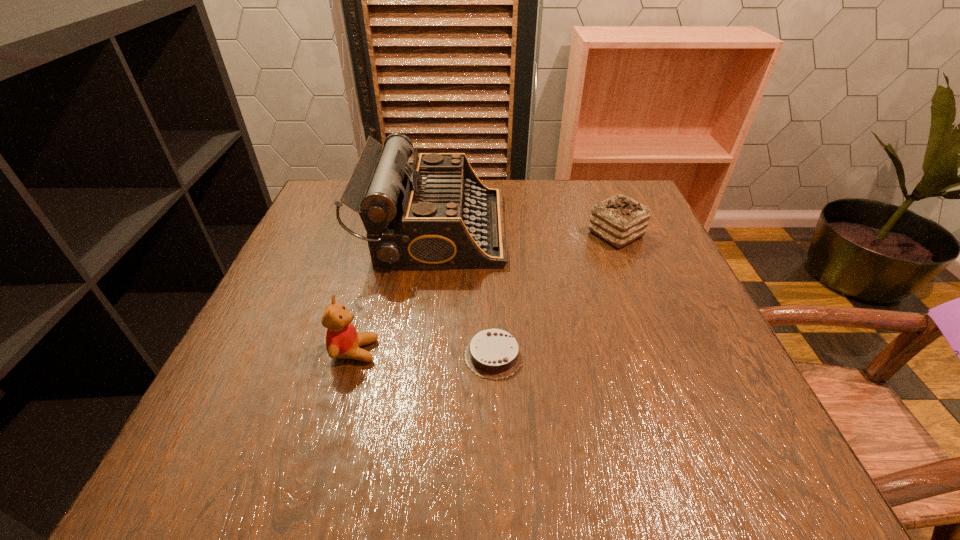
I want to click on free space between the third shortest object and the tallest object, so click(x=395, y=289).

Image resolution: width=960 pixels, height=540 pixels. What are the coordinates of `free space between the shorter chocolate cake and the third shortest object` in the screenshot? It's located at (424, 353).

At what (x,y) coordinates should I click in order to perform the action: click on the closest object relative to the taller chocolate cake. Please return your answer as a coordinate pair (x, y). The height and width of the screenshot is (540, 960). Looking at the image, I should click on (434, 214).

Locate an element on the screen. The width and height of the screenshot is (960, 540). object identified as the third closest to the third shortest object is located at coordinates (619, 220).

This screenshot has height=540, width=960. In order to click on free space that satisfies the following two spatial constraints: 1. on the back side of the farther chocolate cake; 2. on the keyboard of the typewriter in this screenshot , I will do `click(613, 228)`.

Identify the location of vacant space that satisfies the following two spatial constraints: 1. on the keyboard of the shorter chocolate cake; 2. on the left side of the typewriter. The image size is (960, 540). (419, 355).

This screenshot has width=960, height=540. I want to click on free space that satisfies the following two spatial constraints: 1. on the keyboard of the typewriter; 2. on the left side of the nearer chocolate cake, so click(419, 355).

Image resolution: width=960 pixels, height=540 pixels. I want to click on free spot that satisfies the following two spatial constraints: 1. on the back side of the farther chocolate cake; 2. on the keyboard of the tallest object, so click(x=613, y=228).

This screenshot has width=960, height=540. I want to click on free space that satisfies the following two spatial constraints: 1. on the back side of the shorter chocolate cake; 2. on the front-facing side of the teddy bear, so click(x=493, y=351).

Locate an element on the screen. vacant area in the image that satisfies the following two spatial constraints: 1. on the keyboard of the tallest object; 2. on the right side of the taller chocolate cake is located at coordinates (434, 234).